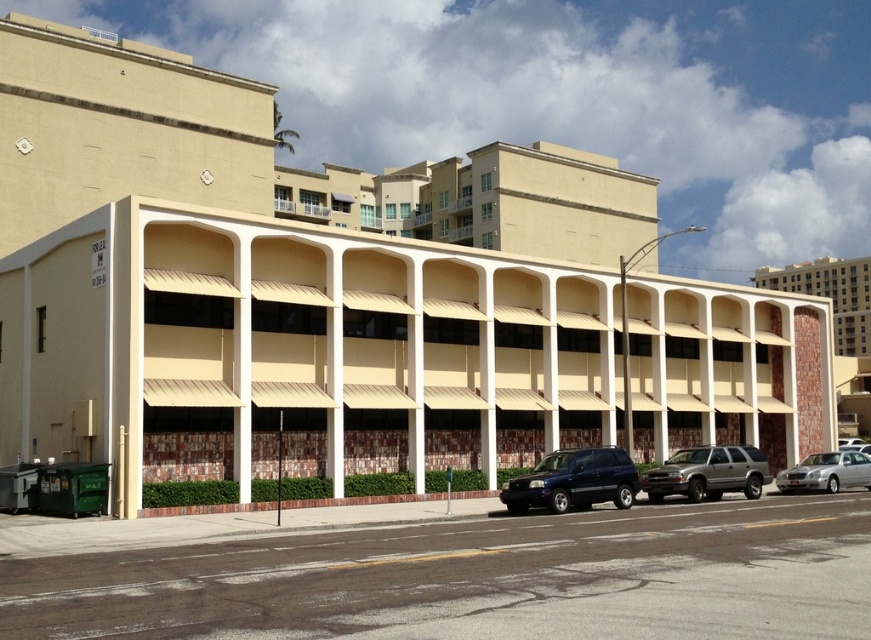
You are a delivery driver who needs to park your shiny dark blue suv at center near the beige brick building at upper right. Given that the parking spot must be within 200 meters, can you safely park there?

The shiny dark blue suv at center is 190.22 meters from the beige brick building at upper right, which is within the 200 meters limit. Yes, you can safely park there.

You are a delivery driver approaching the beige brick building at upper right and need to park your shiny dark blue suv at center. Can you park the suv to the left of the building without crossing the sidewalk?

The shiny dark blue suv at center is already positioned on the left side of beige brick building at upper right, so you can park it there without crossing the sidewalk.